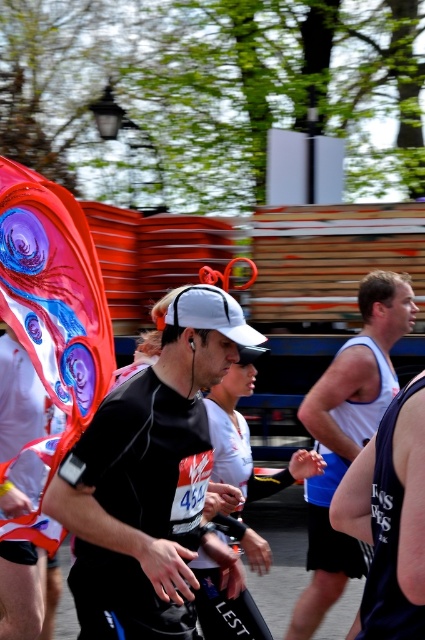
Which is more to the right, white tank top at center or white matte cap at center?

white tank top at center

Is white tank top at center in front of white matte cap at center?

No.

You are a GUI agent. You are given a task and a screenshot of the screen. Output one action in this format:
    pyautogui.click(x=<x>, y=<y>)
    Task: Click on the white tank top at center
    
    Given the screenshot: What is the action you would take?
    click(x=348, y=436)

Where is `white tank top at center`? This screenshot has width=425, height=640. white tank top at center is located at coordinates (348, 436).

Which is above, black matte running shirt at center or white matte cap at center?

black matte running shirt at center is higher up.

Between black matte running shirt at center and white matte cap at center, which one has less height?

white matte cap at center

Does point (130, 518) come in front of point (201, 557)?

That is True.

Where is `black matte running shirt at center`? This screenshot has width=425, height=640. black matte running shirt at center is located at coordinates (147, 481).

Is point (107, 477) farther from camera compared to point (384, 394)?

No.

Who is shorter, black matte running shirt at center or white tank top at center?

black matte running shirt at center

At what (x,y) coordinates should I click in order to perform the action: click on black matte running shirt at center. Please return your answer as a coordinate pair (x, y). Image resolution: width=425 pixels, height=640 pixels. Looking at the image, I should click on (147, 481).

The image size is (425, 640). I want to click on black matte running shirt at center, so click(147, 481).